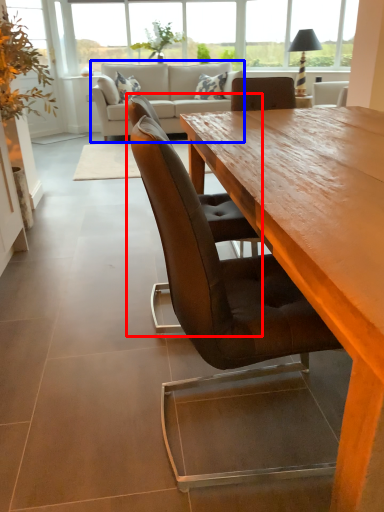
Question: Among these objects, which one is nearest to the camera, chair (highlighted by a red box) or studio couch (highlighted by a blue box)?

Choices:
 (A) chair
 (B) studio couch

Answer: (A)